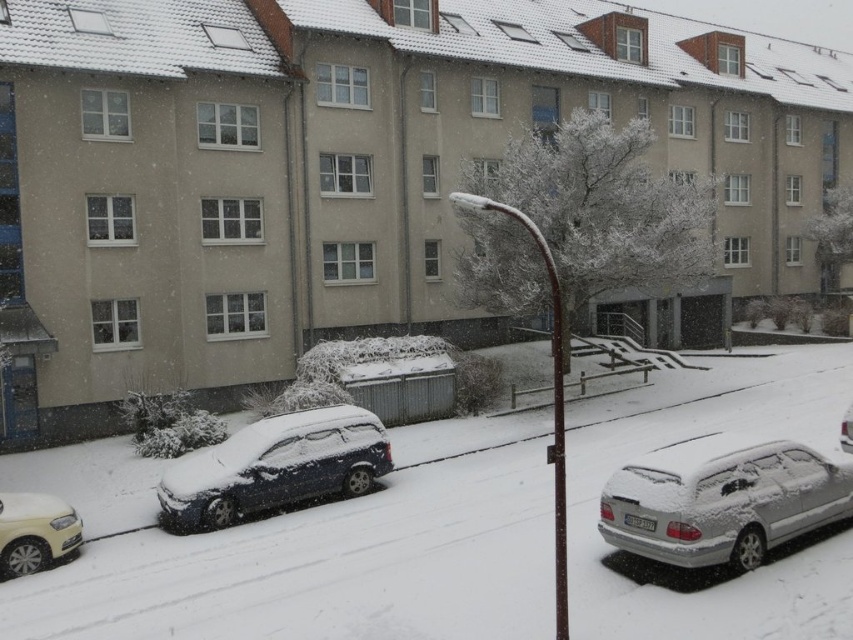
Question: Observing the image, what is the correct spatial positioning of matte white car at lower left in reference to sleek silver sedan at center?

Choices:
 (A) left
 (B) right

Answer: (A)

Question: Which object is the closest to the sleek silver sedan at center?

Choices:
 (A) sleek metallic car at left
 (B) silver metallic car at lower right

Answer: (B)

Question: In this image, where is silver metallic car at lower right located relative to sleek metallic car at left?

Choices:
 (A) above
 (B) below

Answer: (A)

Question: Is silver metallic car at lower right thinner than sleek metallic car at left?

Choices:
 (A) yes
 (B) no

Answer: (A)

Question: Which of these objects is positioned farthest from the sleek metallic car at left?

Choices:
 (A) silver metallic car at lower right
 (B) matte white car at lower left
 (C) sleek silver sedan at center

Answer: (C)

Question: Which point is closer to the camera?

Choices:
 (A) sleek silver sedan at center
 (B) sleek metallic car at left

Answer: (B)